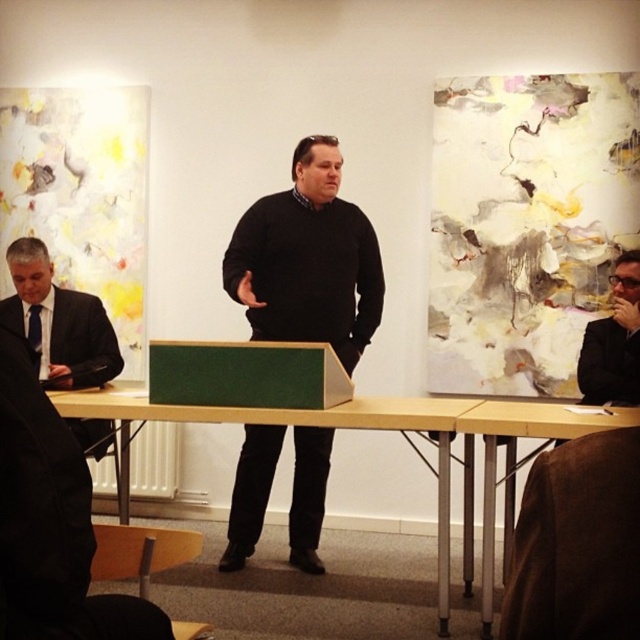
You are organizing a meeting in this room and need to seat two people. The yellow wood table at lower right and the matte black suit at right are both present. Which object should you consider for seating arrangements, and why?

The yellow wood table at lower right should be considered for seating arrangements because it is larger in size than the matte black suit at right, making it more suitable for placing chairs or seating attendees.

You are a guest entering the room and need to sit next to the matte black suit at right. Which direction should you move relative to the yellow wood table at lower right?

You should move to the right of the yellow wood table at lower right to sit next to the matte black suit at right, since the yellow wood table at lower right is to the left of the matte black suit at right.